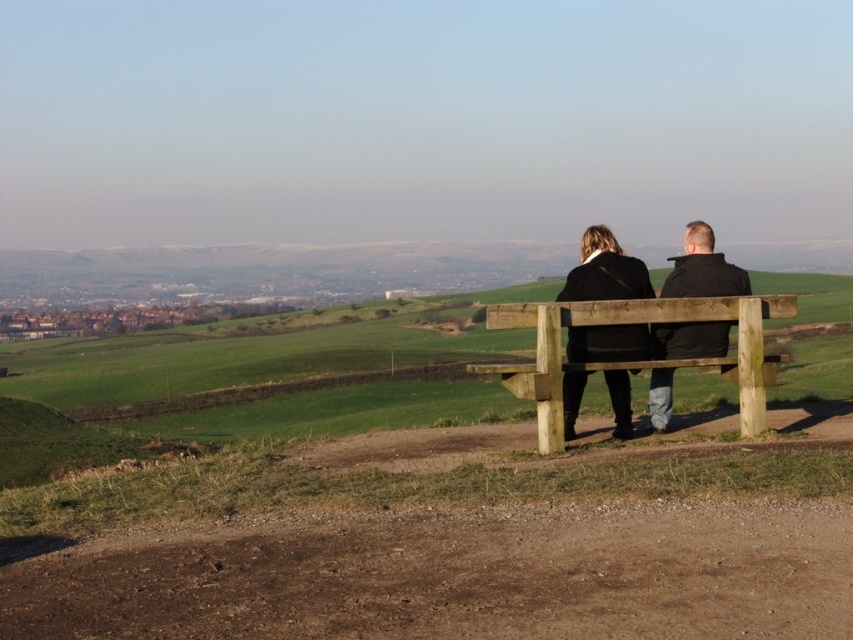
You are standing in the scene and want to place a small flag at each of the two points labeled point (769, 368) and point (654, 422). Which point is closer to you when you are facing the bench?

Point (769, 368) is closer to the camera than point (654, 422), so the flag placed at point (769, 368) will be closer to you.

You are a photographer trying to capture the two individuals on the wooden bench in the scene. You notice both the black matte coat at center and the black leather jacket at center. Which one is positioned lower on the bench?

The black matte coat at center is below the black leather jacket at center, so it is positioned lower on the bench.